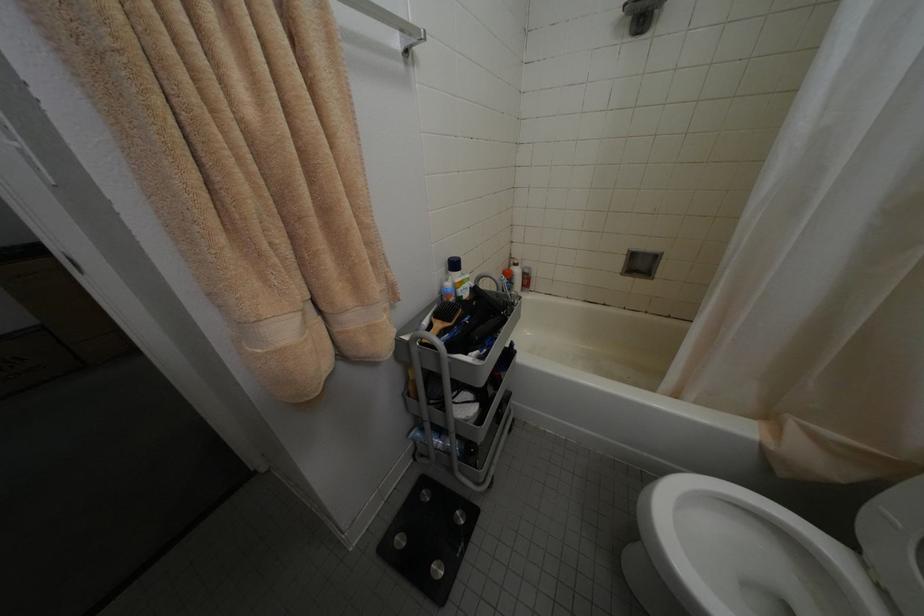
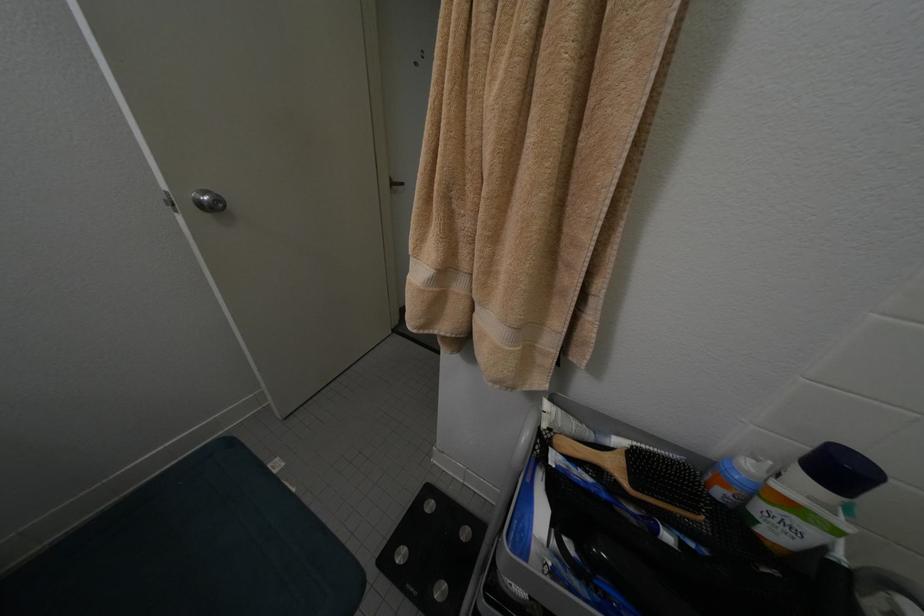
The first image is from the beginning of the video and the second image is from the end. How did the camera likely rotate when shooting the video?

The camera's rotation is toward left-down.